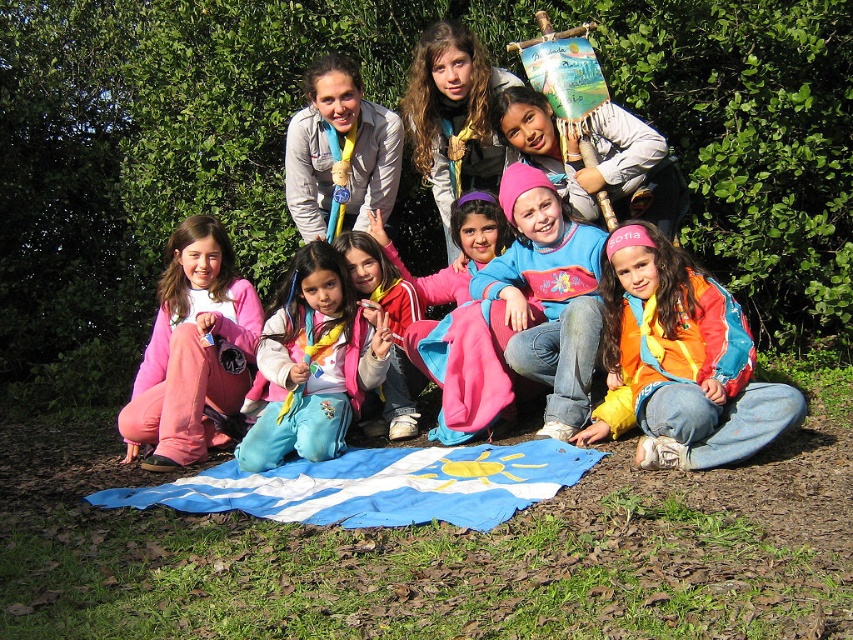
Question: Is rainbow fleece jacket at lower right bigger than blue fabric flag at lower center?

Choices:
 (A) yes
 (B) no

Answer: (A)

Question: Is pink fleece jacket at center closer to camera compared to matte gray jacket at upper center?

Choices:
 (A) no
 (B) yes

Answer: (B)

Question: Which of the following is the farthest from the observer?

Choices:
 (A) pink fleece jacket at center
 (B) blue fabric flag at lower center
 (C) rainbow fleece jacket at lower right

Answer: (A)

Question: Among these objects, which one is nearest to the camera?

Choices:
 (A) pink fleece jacket at center
 (B) pink fleece pants at lower left

Answer: (A)

Question: Is rainbow fleece jacket at lower right in front of matte gray jacket at upper center?

Choices:
 (A) no
 (B) yes

Answer: (B)

Question: Which object is positioned closest to the matte gray jacket at upper center?

Choices:
 (A) rainbow fleece jacket at lower right
 (B) matte pink pants at center

Answer: (B)